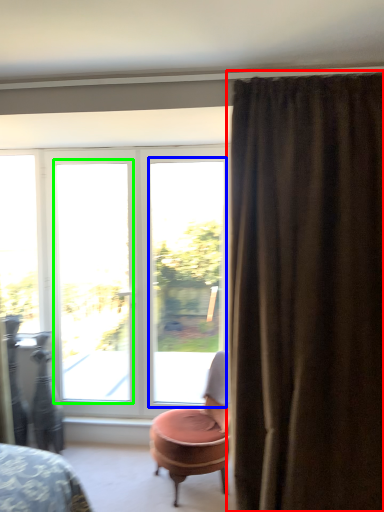
Question: Considering the real-world distances, which object is farthest from curtain (highlighted by a red box)? window (highlighted by a blue box) or window (highlighted by a green box)?

Choices:
 (A) window
 (B) window

Answer: (B)